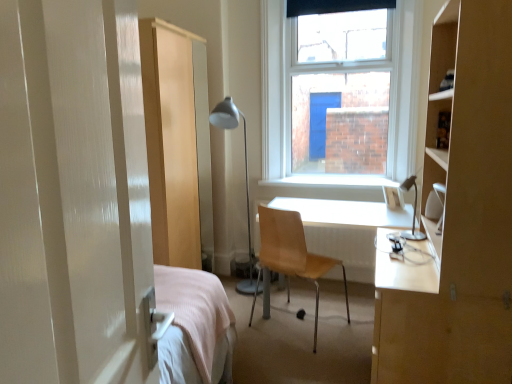
Where is `free area in between white glossy desk at center and wooden chair at center`? free area in between white glossy desk at center and wooden chair at center is located at coordinates (331, 341).